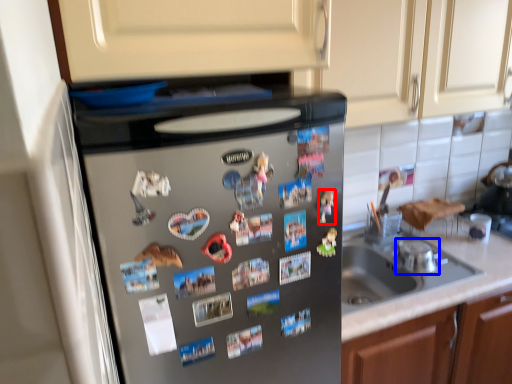
Question: Among these objects, which one is nearest to the camera, toy (highlighted by a red box) or appliance (highlighted by a blue box)?

Choices:
 (A) toy
 (B) appliance

Answer: (A)